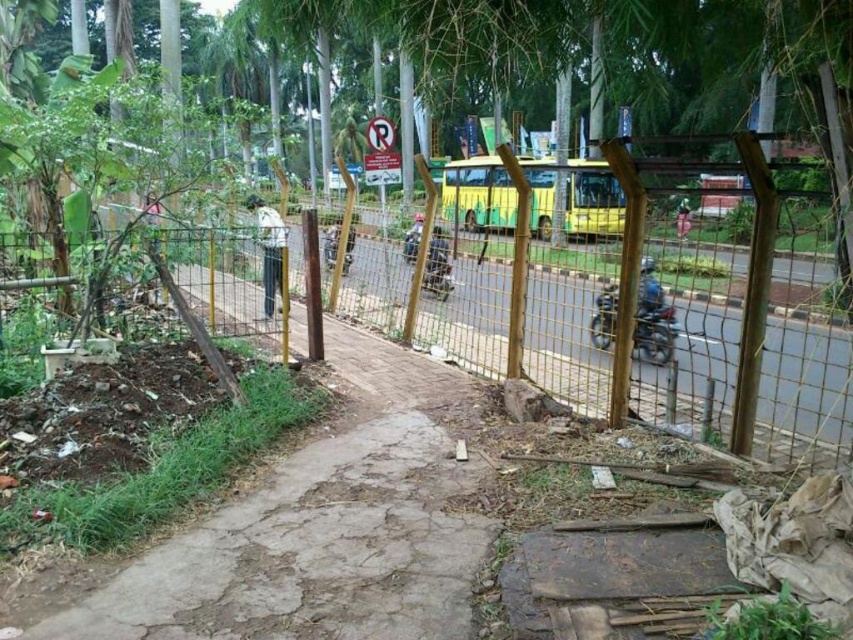
You are standing at the roadside scene described and need to determine which object occupies more space in the image. Which one is larger in size between the brown rough dirt track at lower left and the white fabric shirt at center?

The brown rough dirt track at lower left is larger in size than the white fabric shirt at center, so the brown rough dirt track at lower left occupies more space in the image.

You are a delivery person who just arrived at this location and need to place a blue metallic helmet at center on the ground. The GPS coordinates for the helmet are given as a point at 0.466, 0.761 in the image. Can you confirm if this location is safe to place the helmet?

The blue metallic helmet at center is located at point (648,294), which is on the dirt path leading towards the fenced area. Since the ground there is uneven and covered with debris, placing the helmet might not be stable. Consider checking for a flatter area nearby.